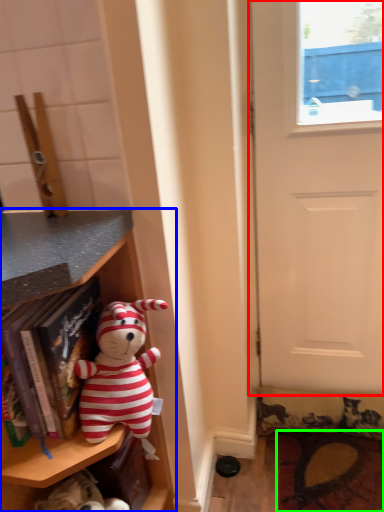
Question: Based on their relative distances, which object is farther from door (highlighted by a red box)? Choose from shelf (highlighted by a blue box) and doormat (highlighted by a green box).

Choices:
 (A) shelf
 (B) doormat

Answer: (A)